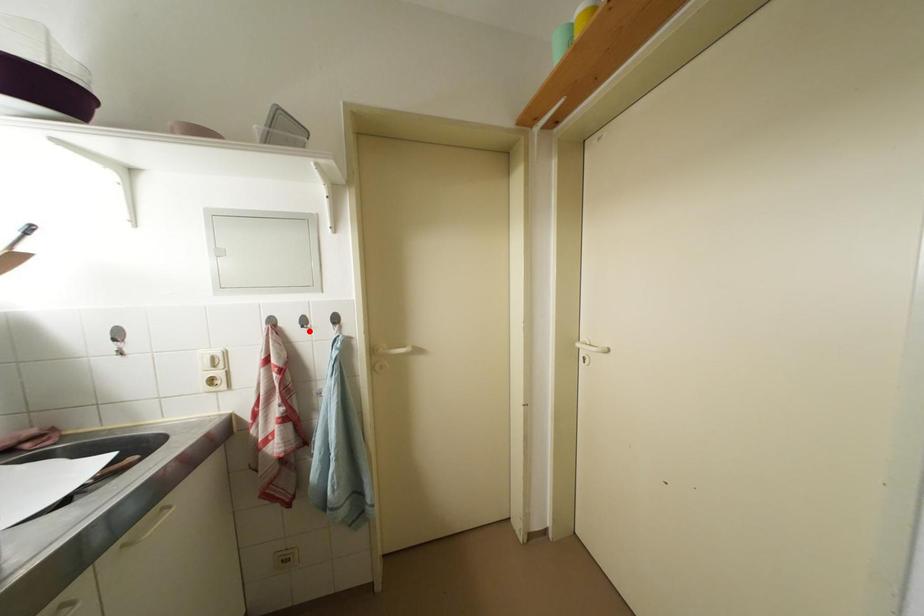
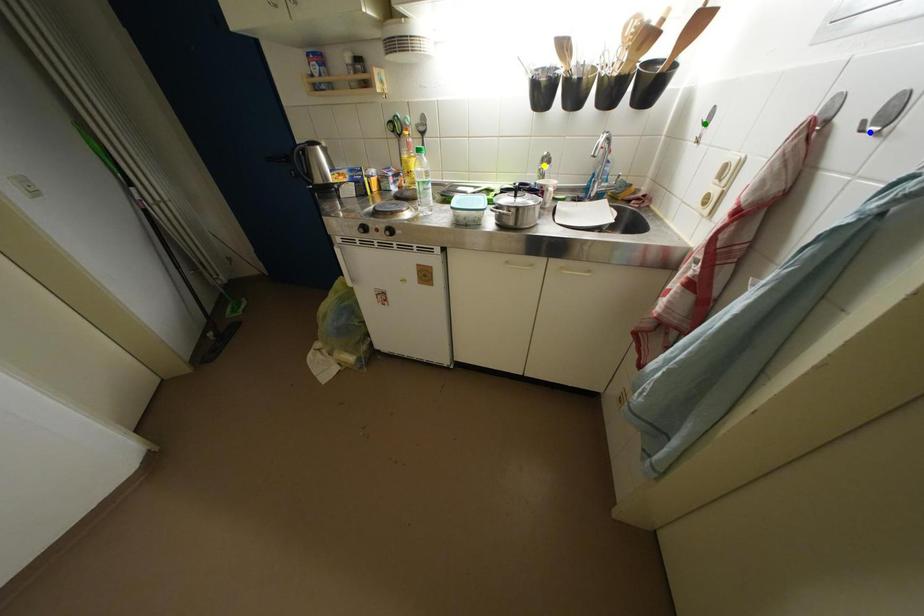
Question: I am providing you with two images of the same scene from different viewpoints. A red point is marked on the first image. You are given multiple points on the second image. Which mark in image 2 goes with the point in image 1?

Choices:
 (A) green point
 (B) blue point
 (C) yellow point

Answer: (B)